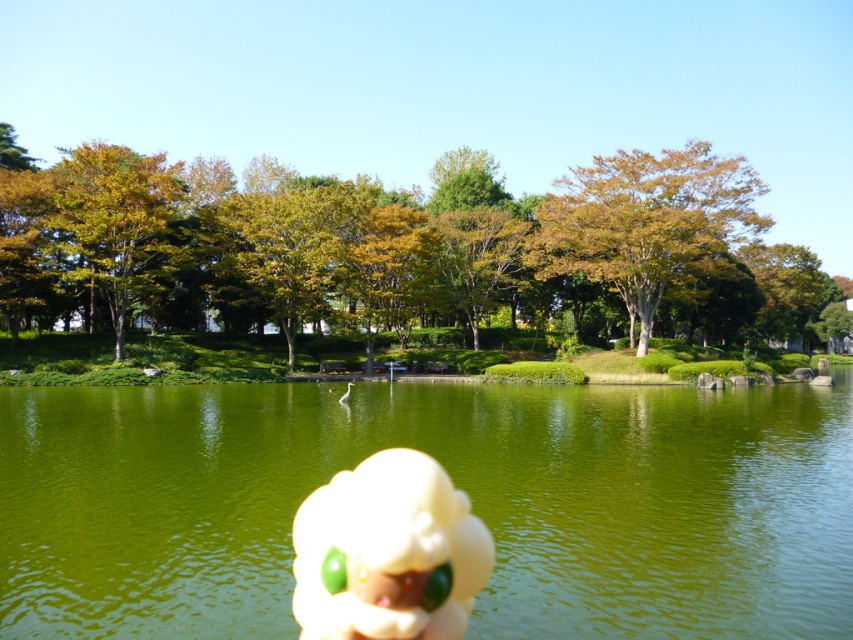
Question: From the image, what is the correct spatial relationship of golden-brown foliage at center in relation to brown/leathery tree at upper right?

Choices:
 (A) above
 (B) below

Answer: (A)

Question: Is white plush toy at center wider than golden-brown foliage at upper left?

Choices:
 (A) yes
 (B) no

Answer: (B)

Question: Considering the real-world distances, which object is farthest from the golden-brown foliage at center?

Choices:
 (A) green smooth water at center
 (B) golden-brown foliage at upper left

Answer: (A)

Question: Which object is positioned farthest from the golden-brown foliage at upper left?

Choices:
 (A) white plush toy at center
 (B) green smooth water at center

Answer: (A)

Question: Can you confirm if green smooth water at center is positioned above white plush toy at center?

Choices:
 (A) no
 (B) yes

Answer: (A)

Question: Which object is closer to the camera taking this photo?

Choices:
 (A) green smooth water at center
 (B) brown/leathery tree at upper right

Answer: (A)